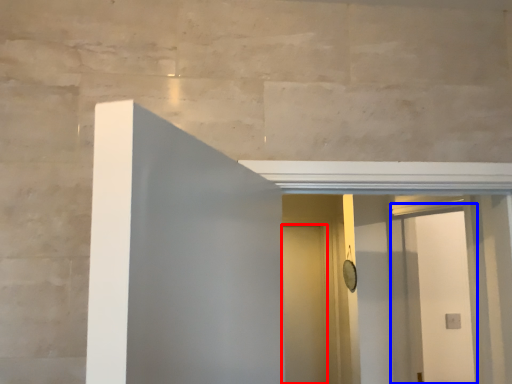
Question: Which object is closer to the camera taking this photo, door (highlighted by a red box) or screen door (highlighted by a blue box)?

Choices:
 (A) door
 (B) screen door

Answer: (B)